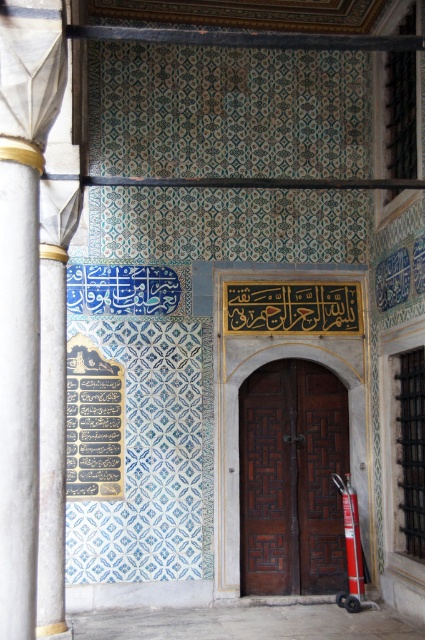
Question: Which point appears closest to the camera in this image?

Choices:
 (A) (269, 588)
 (B) (11, 195)

Answer: (B)

Question: Which point is closer to the camera?

Choices:
 (A) white marble column at left
 (B) brown wooden door at center

Answer: (A)

Question: Can you confirm if white marble column at left is smaller than brown wooden door at center?

Choices:
 (A) no
 (B) yes

Answer: (B)

Question: Is white marble column at left above brown wooden door at center?

Choices:
 (A) no
 (B) yes

Answer: (B)

Question: Which object is closer to the camera taking this photo?

Choices:
 (A) brown wooden door at center
 (B) white marble column at left

Answer: (B)

Question: Does white marble column at left appear under brown wooden door at center?

Choices:
 (A) no
 (B) yes

Answer: (A)